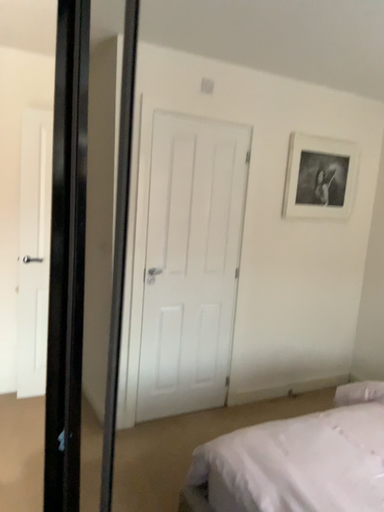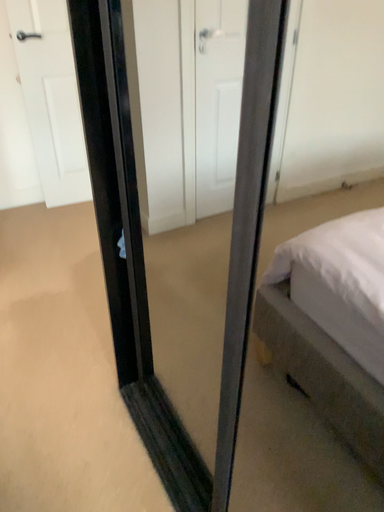
Question: Which way did the camera rotate in the video?

Choices:
 (A) rotated downward
 (B) rotated upward

Answer: (A)